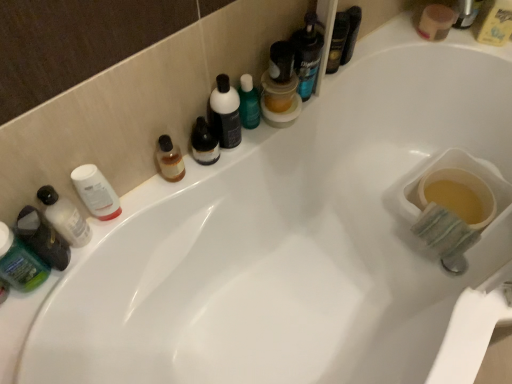
Question: In which direction should I rotate to look at matte black bottle at center, marked as the first toiletry in a right-to-left arrangement?

Choices:
 (A) right
 (B) left

Answer: (B)

Question: Would you consider translucent plastic bottle at left, which is the second toiletry from left to right, to be distant from translucent plastic jar at upper center, the 2th mouthwash from the bottom?

Choices:
 (A) no
 (B) yes

Answer: (A)

Question: Considering the relative sizes of translucent plastic bottle at left, which is the second toiletry from left to right, and translucent plastic jar at upper center, the 2th mouthwash from the bottom, in the image provided, is translucent plastic bottle at left, which is the second toiletry from left to right, smaller than translucent plastic jar at upper center, the 2th mouthwash from the bottom,?

Choices:
 (A) no
 (B) yes

Answer: (B)

Question: Could you tell me if translucent plastic bottle at left, which is the second toiletry from left to right, is turned towards translucent plastic jar at upper center, which is the 3th mouthwash in back-to-front order?

Choices:
 (A) yes
 (B) no

Answer: (B)

Question: From a real-world perspective, is translucent plastic bottle at left, positioned as the 3th toiletry in right-to-left order, located higher than translucent plastic jar at upper center, placed as the 2th mouthwash when sorted from front to back?

Choices:
 (A) no
 (B) yes

Answer: (B)

Question: Is translucent plastic bottle at left, which is the second toiletry from left to right, positioned before translucent plastic jar at upper center, which is the 3th mouthwash in back-to-front order?

Choices:
 (A) no
 (B) yes

Answer: (B)

Question: From a real-world perspective, is translucent plastic bottle at left, which is the second toiletry from left to right, positioned under translucent plastic jar at upper center, the 2th mouthwash from the bottom, based on gravity?

Choices:
 (A) yes
 (B) no

Answer: (B)

Question: Is translucent plastic mouthwash at upper center, which is counted as the second mouthwash, starting from the right, turned away from translucent plastic jar at upper center, placed as the 2th mouthwash when sorted from front to back?

Choices:
 (A) no
 (B) yes

Answer: (A)

Question: Is translucent plastic mouthwash at upper center, the 2th mouthwash when ordered from top to bottom, located outside translucent plastic jar at upper center, which is the 3th mouthwash in back-to-front order?

Choices:
 (A) yes
 (B) no

Answer: (A)

Question: From a real-world perspective, is translucent plastic mouthwash at upper center, which is counted as the second mouthwash, starting from the right, located beneath translucent plastic jar at upper center, which is counted as the third mouthwash, starting from the right?

Choices:
 (A) yes
 (B) no

Answer: (B)

Question: Is translucent plastic mouthwash at upper center, the 2th mouthwash in the back-to-front sequence, wider than translucent plastic jar at upper center, which is counted as the third mouthwash, starting from the right?

Choices:
 (A) yes
 (B) no

Answer: (B)

Question: From a real-world perspective, is translucent plastic mouthwash at upper center, which ranks as the third mouthwash in bottom-to-top order, on top of translucent plastic jar at upper center, which is counted as the third mouthwash, starting from the right?

Choices:
 (A) no
 (B) yes

Answer: (B)

Question: Considering the relative positions of translucent plastic mouthwash at upper center, which is counted as the second mouthwash, starting from the right, and translucent plastic jar at upper center, placed as the 2th mouthwash when sorted from front to back, in the image provided, is translucent plastic mouthwash at upper center, which is counted as the second mouthwash, starting from the right, to the right of translucent plastic jar at upper center, placed as the 2th mouthwash when sorted from front to back, from the viewer's perspective?

Choices:
 (A) yes
 (B) no

Answer: (A)

Question: Is yellow plastic bottle at upper right, acting as the 4th mouthwash starting from the front, facing away from translucent plastic bottle at left, positioned as the 3th toiletry in right-to-left order?

Choices:
 (A) no
 (B) yes

Answer: (A)